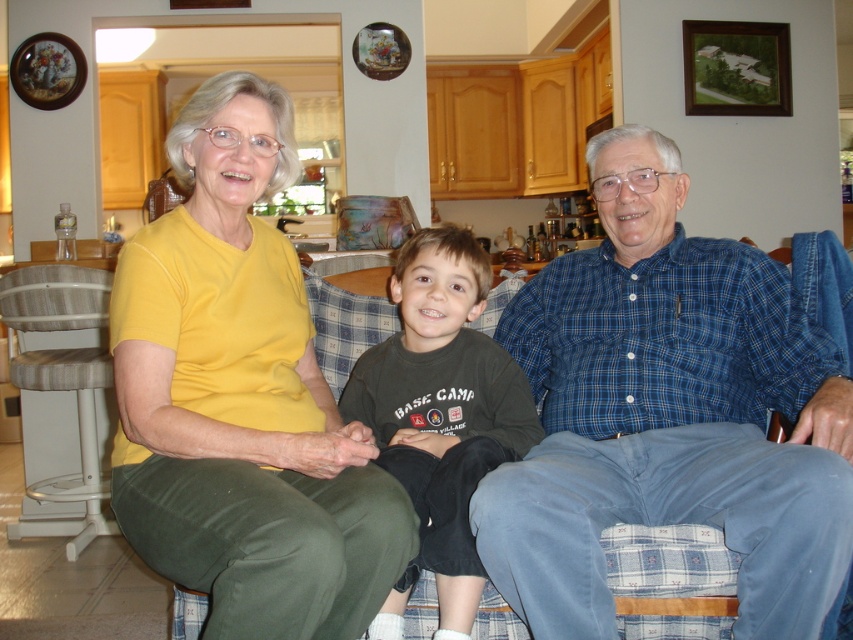
Is blue plaid shirt at center closer to camera compared to wooden textured stool at left?

Yes, blue plaid shirt at center is in front of wooden textured stool at left.

Which is in front, point (648, 440) or point (57, 280)?

Point (648, 440)

Find the location of `blue plaid shirt at center`. blue plaid shirt at center is located at coordinates (668, 413).

Is point (378, 342) positioned behind point (84, 474)?

No.

Is dark gray cotton shirt at center closer to camera compared to wooden textured stool at left?

That is True.

I want to click on dark gray cotton shirt at center, so click(440, 416).

Who is lower down, blue plaid shirt at center or yellow matte shirt at upper left?

Positioned lower is blue plaid shirt at center.

Which is in front, point (819, 332) or point (215, 157)?

Positioned in front is point (215, 157).

Is point (766, 580) more distant than point (254, 620)?

Yes, point (766, 580) is behind point (254, 620).

The width and height of the screenshot is (853, 640). Find the location of `blue plaid shirt at center`. blue plaid shirt at center is located at coordinates coord(668,413).